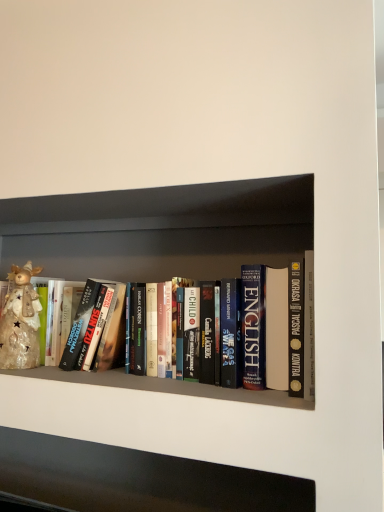
Question: Considering the relative positions of shiny metallic reindeer at left and hardcover books at center in the image provided, is shiny metallic reindeer at left to the left of hardcover books at center from the viewer's perspective?

Choices:
 (A) no
 (B) yes

Answer: (B)

Question: Does shiny metallic reindeer at left have a greater height compared to hardcover books at center?

Choices:
 (A) no
 (B) yes

Answer: (A)

Question: Considering the relative sizes of shiny metallic reindeer at left and hardcover books at center in the image provided, is shiny metallic reindeer at left bigger than hardcover books at center?

Choices:
 (A) yes
 (B) no

Answer: (B)

Question: Does shiny metallic reindeer at left have a lesser width compared to hardcover books at center?

Choices:
 (A) yes
 (B) no

Answer: (A)

Question: Is shiny metallic reindeer at left next to hardcover books at center?

Choices:
 (A) yes
 (B) no

Answer: (B)

Question: Is shiny metallic reindeer at left wider than hardcover books at center?

Choices:
 (A) no
 (B) yes

Answer: (A)

Question: Is hardcover books at center far away from shiny metallic reindeer at left?

Choices:
 (A) yes
 (B) no

Answer: (B)

Question: Does hardcover books at center have a smaller size compared to shiny metallic reindeer at left?

Choices:
 (A) no
 (B) yes

Answer: (A)

Question: Is hardcover books at center next to shiny metallic reindeer at left and touching it?

Choices:
 (A) yes
 (B) no

Answer: (B)

Question: Can you confirm if hardcover books at center is positioned to the left of shiny metallic reindeer at left?

Choices:
 (A) no
 (B) yes

Answer: (A)

Question: Is hardcover books at center positioned beyond the bounds of shiny metallic reindeer at left?

Choices:
 (A) yes
 (B) no

Answer: (A)

Question: Can you confirm if hardcover books at center is positioned to the right of shiny metallic reindeer at left?

Choices:
 (A) yes
 (B) no

Answer: (A)

Question: Considering their positions, is shiny metallic reindeer at left located in front of or behind hardcover books at center?

Choices:
 (A) front
 (B) behind

Answer: (B)